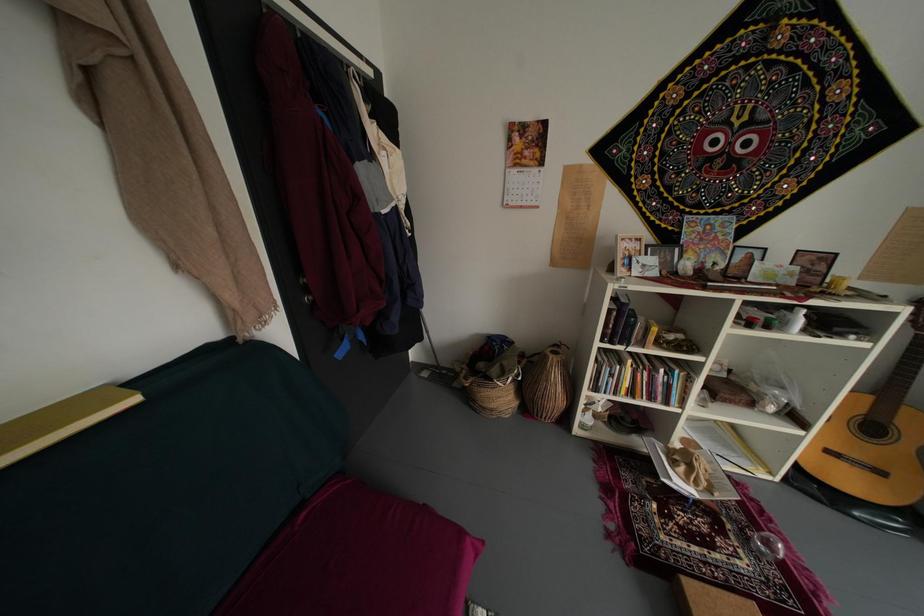
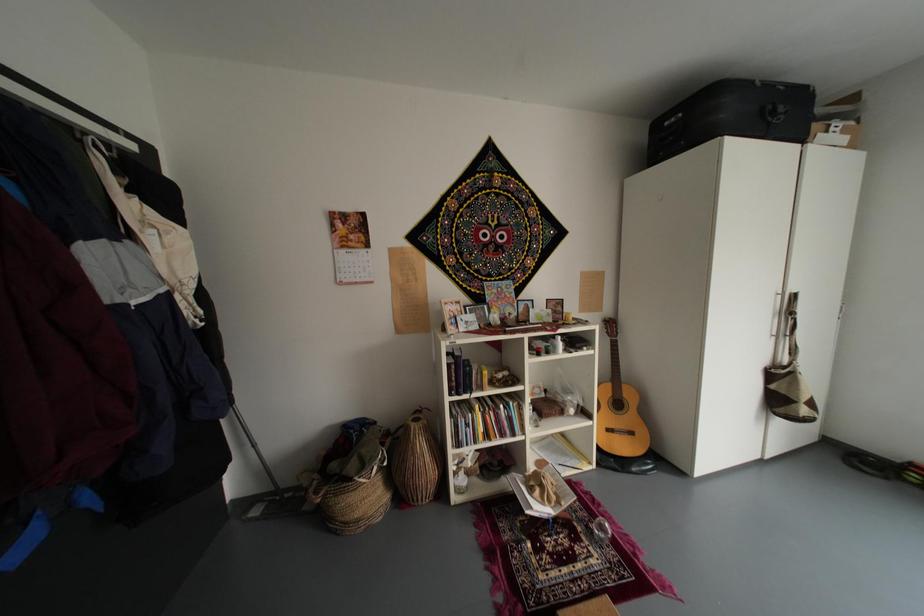
Question: Based on the continuous images, in which direction is the camera rotating? Reply with the corresponding letter.

Choices:
 (A) Left
 (B) Right
 (C) Up
 (D) Down

Answer: (B)